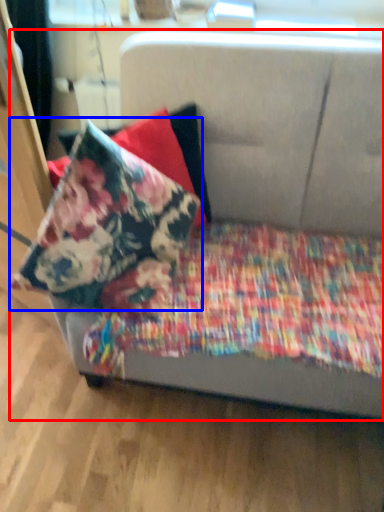
Question: Which point is closer to the camera, studio couch (highlighted by a red box) or pillow (highlighted by a blue box)?

Choices:
 (A) studio couch
 (B) pillow

Answer: (A)